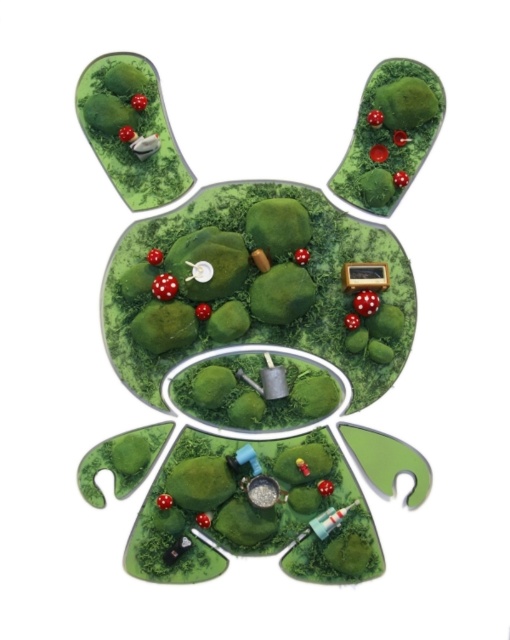
Question: Does matte white mushroom at upper left have a lesser width compared to matte green mushroom at upper right?

Choices:
 (A) no
 (B) yes

Answer: (A)

Question: Does matte white mushroom at upper left lie behind matte green mushroom at upper right?

Choices:
 (A) no
 (B) yes

Answer: (A)

Question: Which point is closer to the camera?

Choices:
 (A) (420, 70)
 (B) (118, 145)

Answer: (A)

Question: Which object is closer to the camera taking this photo?

Choices:
 (A) matte green mushroom at upper right
 (B) matte white mushroom at upper left

Answer: (B)

Question: Does matte white mushroom at upper left appear on the left side of matte green mushroom at upper right?

Choices:
 (A) yes
 (B) no

Answer: (A)